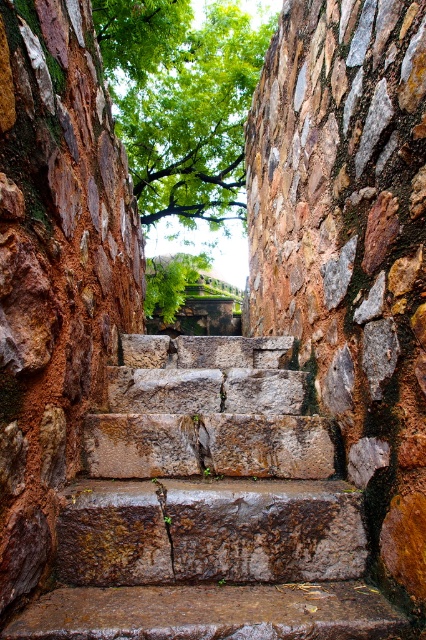
Question: Does rusty stone stairs at center appear on the right side of green leafy tree at upper center?

Choices:
 (A) yes
 (B) no

Answer: (A)

Question: Can you confirm if rusty stone stairs at center is thinner than green leafy tree at upper center?

Choices:
 (A) yes
 (B) no

Answer: (A)

Question: Among these points, which one is nearest to the camera?

Choices:
 (A) (184, 88)
 (B) (112, 557)

Answer: (B)

Question: Which point appears farthest from the camera in this image?

Choices:
 (A) (175, 448)
 (B) (195, 61)

Answer: (B)

Question: Is rusty stone stairs at center wider than green leafy tree at upper center?

Choices:
 (A) yes
 (B) no

Answer: (B)